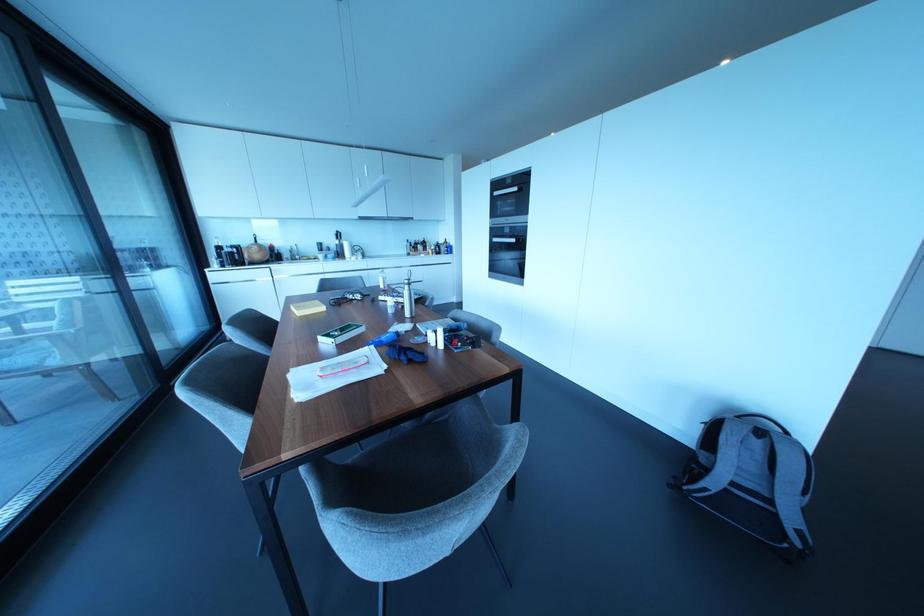
Image resolution: width=924 pixels, height=616 pixels. I want to click on backpack top handle, so click(x=761, y=419).